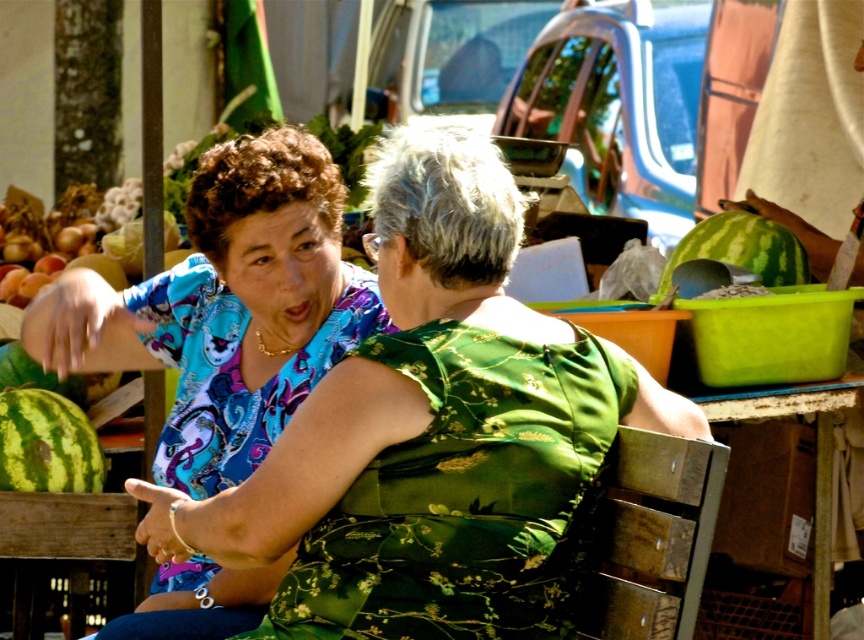
You are standing at the point marked as point (348, 449) in the image. You want to walk to the nearest exit, which is located 3 meters away from your current position. Can you reach the exit without moving more than 3 meters?

The distance between point (348, 449) and the viewer is 2.75 meters. Since the exit is 3 meters away, you can reach it without moving more than 3 meters.

You are standing at the origin of a coordinate system placed at the bottom left corner of the image. A point at coordinates point (432, 435) is marked. What object is located at this coordinate point?

The point at coordinates point (432, 435) corresponds to the matte blue blouse at center.